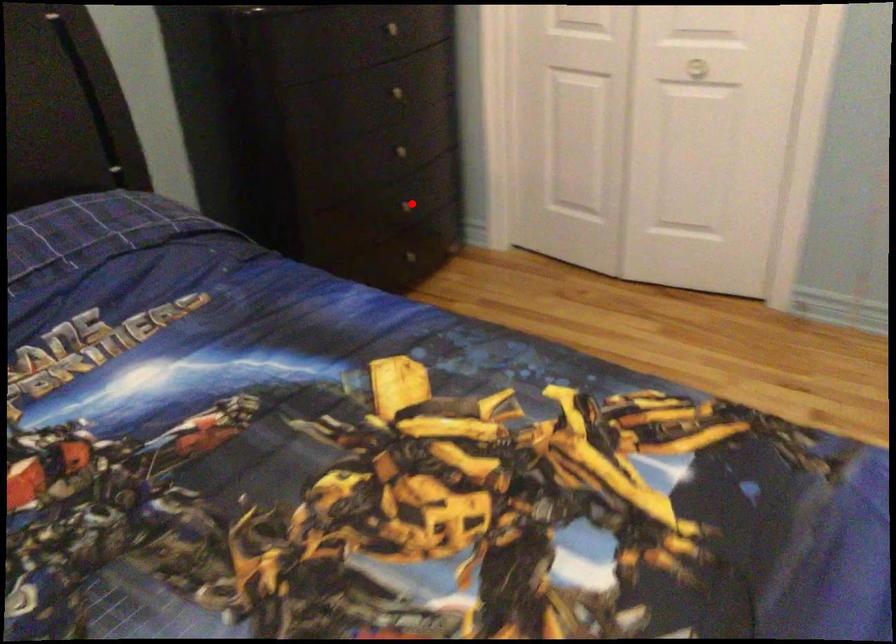
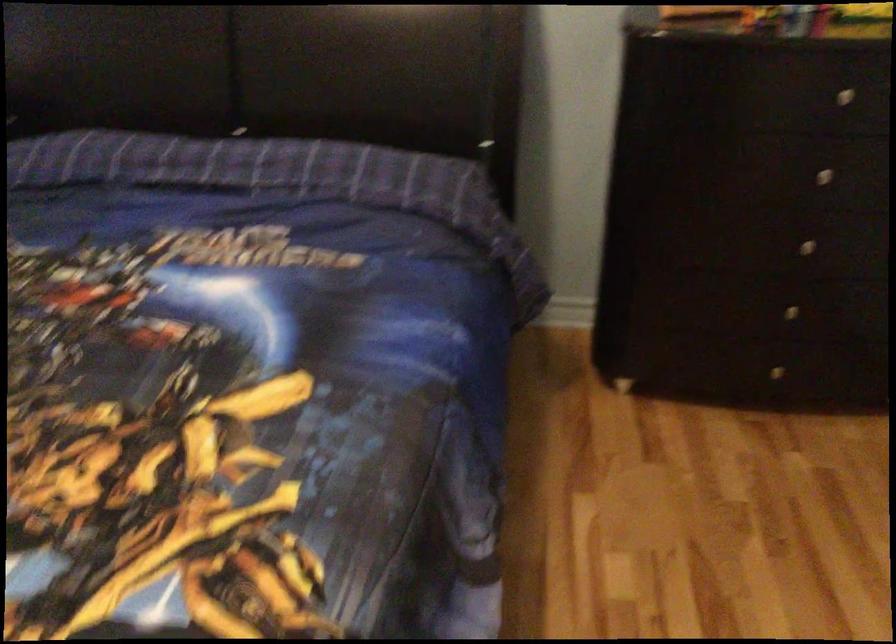
In the second image, find the point that corresponds to the highlighted location in the first image.

(790, 310)